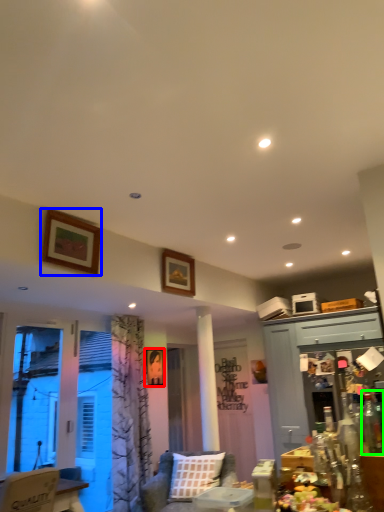
Question: Which is farther away from picture frame (highlighted by a red box)? picture frame (highlighted by a blue box) or bottle (highlighted by a green box)?

Choices:
 (A) picture frame
 (B) bottle

Answer: (B)